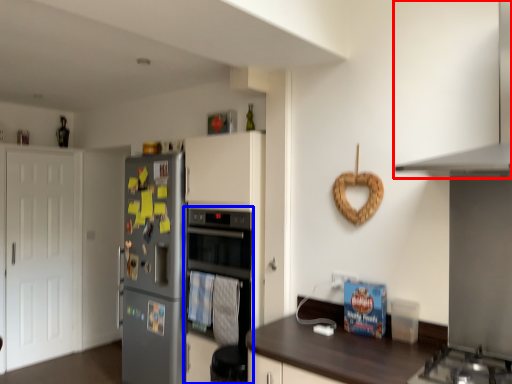
Question: Which object is closer to the camera taking this photo, exhaust hood (highlighted by a red box) or oven (highlighted by a blue box)?

Choices:
 (A) exhaust hood
 (B) oven

Answer: (A)